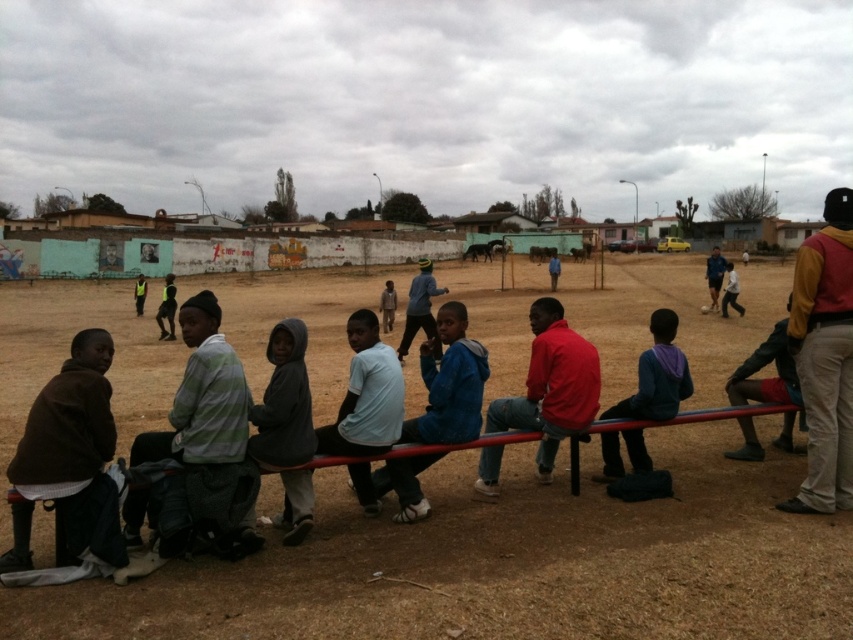
Question: Does striped fabric jacket at center have a larger size compared to light brown fabric shirt at center?

Choices:
 (A) no
 (B) yes

Answer: (A)

Question: Estimate the real-world distances between objects in this image. Which object is farther from the yellow-green jersey at center?

Choices:
 (A) light blue hoodie at center
 (B) brown dirt field at center
 (C) blue fabric shirt at center

Answer: (A)

Question: Estimate the real-world distances between objects in this image. Which object is closer to the yellow-orange jacket at right?

Choices:
 (A) light brown fabric shirt at center
 (B) purple fleece jacket at center

Answer: (B)

Question: Is red matte shirt at center further to the viewer compared to light blue hoodie at center?

Choices:
 (A) no
 (B) yes

Answer: (A)

Question: Which object is positioned farthest from the red matte shirt at center?

Choices:
 (A) yellow-orange jacket at right
 (B) striped fabric jacket at center
 (C) light blue hoodie at center
 (D) blue fabric shirt at center

Answer: (C)

Question: Can you confirm if brown dirt field at center is bigger than yellow-orange jacket at right?

Choices:
 (A) yes
 (B) no

Answer: (A)